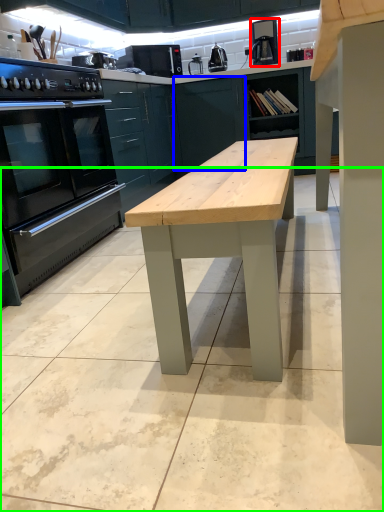
Question: Considering the real-world distances, which object is farthest from coffee machine (highlighted by a red box)? cabinetry (highlighted by a blue box) or concrete (highlighted by a green box)?

Choices:
 (A) cabinetry
 (B) concrete

Answer: (B)